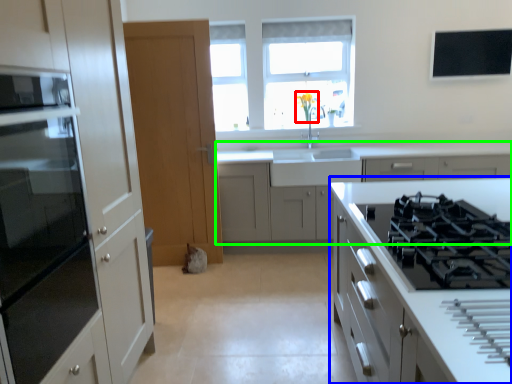
Question: Which object is the closest to the flower (highlighted by a red box)? Choose among these: cabinetry (highlighted by a blue box) or cabinetry (highlighted by a green box).

Choices:
 (A) cabinetry
 (B) cabinetry

Answer: (B)